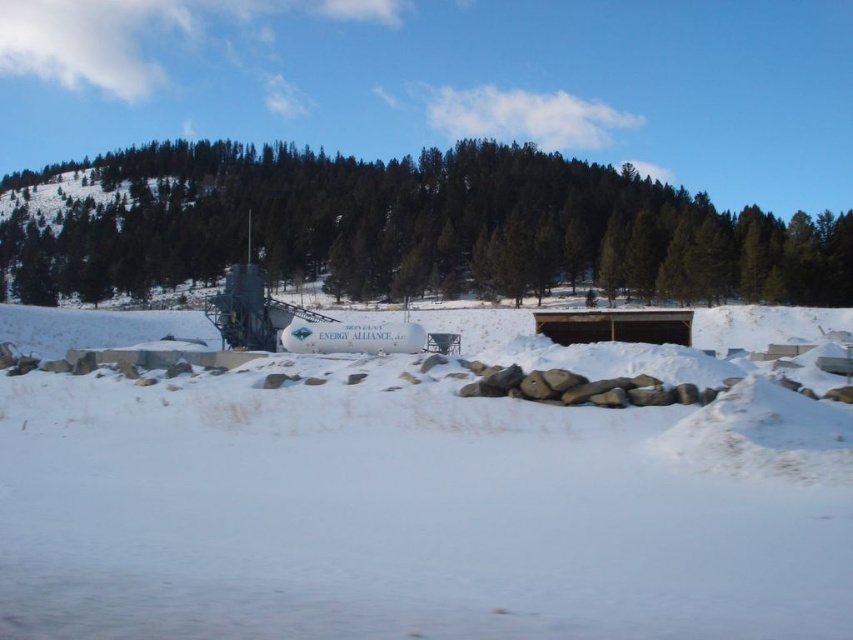
You are a delivery drone carrying a package that requires a flat landing zone. You see the white matte snow at center. Can you land safely here?

The white matte snow at center is 5.23 meters away from the nearest object, which is sufficient space for a standard drone to land safely.

You are an engineer inspecting an energy facility in a snowy area. You see the white matte snow at center and the green matte tree at upper center. Which object is closer to you according to your vantage point?

The white matte snow at center is closer to you because it is in front of the green matte tree at upper center.

You are a delivery drone that needs to fly from the white matte snow at center to the green matte tree at upper center. The drone has a maximum flight range of 300 feet. Can it make the trip without recharging?

The distance between the white matte snow at center and the green matte tree at upper center is 298.31 feet, which is within the drone s maximum flight range of 300 feet. Therefore, the drone can complete the trip without needing to recharge.